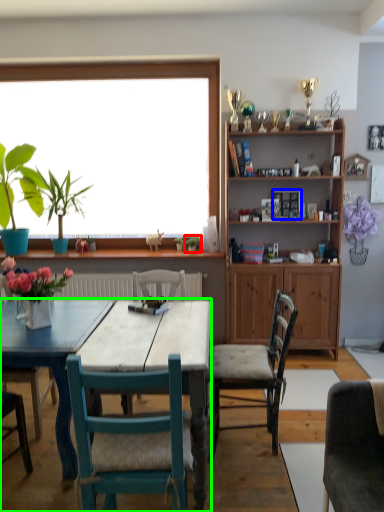
Question: Considering the real-world distances, which object is closest to plant (highlighted by a red box)? picture frame (highlighted by a blue box) or kitchen & dining room table (highlighted by a green box).

Choices:
 (A) picture frame
 (B) kitchen & dining room table

Answer: (A)